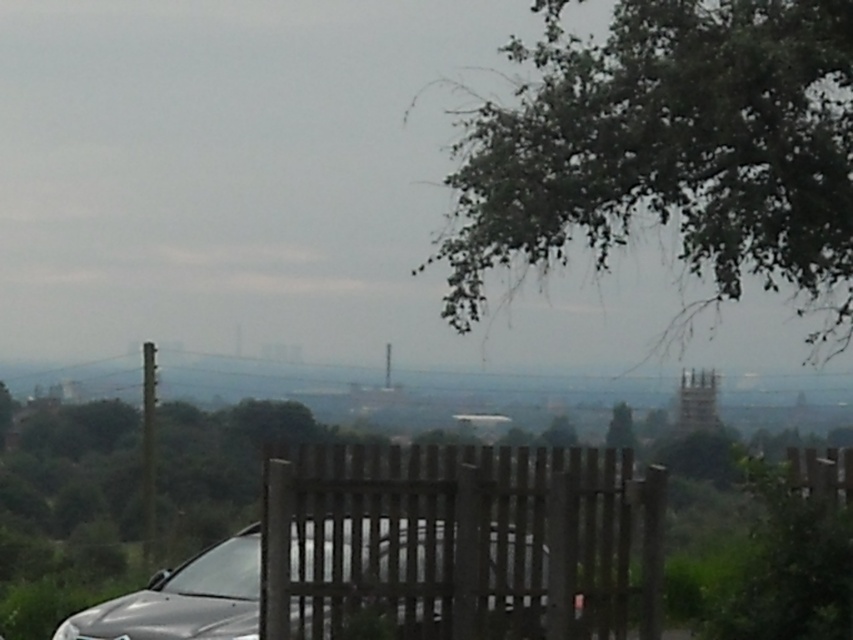
Question: Considering the real-world distances, which object is farthest from the white plastic license plate at center?

Choices:
 (A) satin silver car at center
 (B) brown wooden fence at center
 (C) green leafy tree at center
 (D) green leafy tree at upper right

Answer: (C)

Question: Which object appears closest to the camera in this image?

Choices:
 (A) satin silver car at center
 (B) white plastic license plate at center
 (C) brown wooden fence at center

Answer: (C)

Question: Among these objects, which one is farthest from the camera?

Choices:
 (A) white plastic license plate at center
 (B) brown wooden fence at center
 (C) green leafy tree at upper right

Answer: (A)

Question: Is satin silver car at center below white plastic license plate at center?

Choices:
 (A) no
 (B) yes

Answer: (A)

Question: Is brown wooden fence at center thinner than satin silver car at center?

Choices:
 (A) yes
 (B) no

Answer: (B)

Question: In this image, where is green leafy tree at center located relative to white plastic license plate at center?

Choices:
 (A) above
 (B) below

Answer: (A)